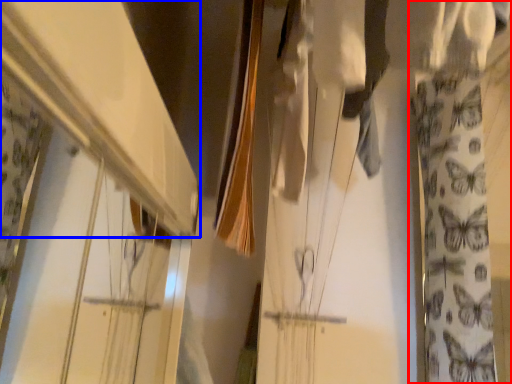
Question: Which object is closer to the camera taking this photo, curtain (highlighted by a red box) or shelf (highlighted by a blue box)?

Choices:
 (A) curtain
 (B) shelf

Answer: (B)